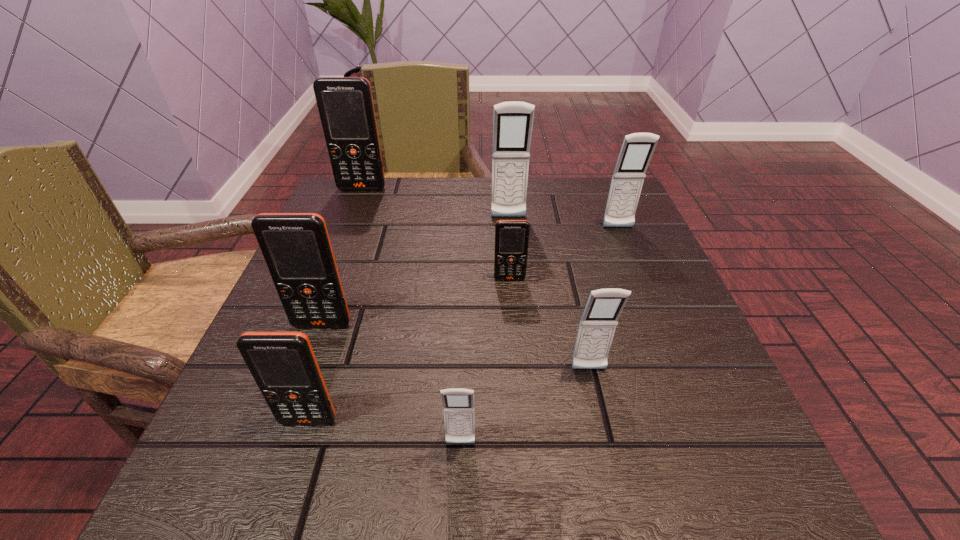
What are the coordinates of `the nearest orange cellular telephone` in the screenshot? It's located at (283, 364).

Identify the location of the second nearest cellular telephone. (283, 364).

The image size is (960, 540). In order to click on the fifth nearest object in this screenshot , I will do `click(511, 236)`.

The height and width of the screenshot is (540, 960). I want to click on the third nearest orange cellular telephone, so click(x=511, y=236).

Find the location of a particular element. This screenshot has height=540, width=960. the nearest cellular telephone is located at coordinates (458, 404).

At what (x,y) coordinates should I click in order to perform the action: click on the leftmost gray cellular telephone. Please return your answer as a coordinate pair (x, y). This screenshot has height=540, width=960. Looking at the image, I should click on (458, 404).

I want to click on blank space located on the screen of the farthest object, so click(350, 219).

Where is `vacant position located 0.290m on the front-facing side of the farthest gray cellular telephone`? The height and width of the screenshot is (540, 960). vacant position located 0.290m on the front-facing side of the farthest gray cellular telephone is located at coordinates (516, 314).

Identify the location of vacant space located 0.240m on the front-facing side of the sixth nearest cellular telephone. The width and height of the screenshot is (960, 540). (652, 309).

Identify the location of vacant area situated 0.200m on the screen of the fourth nearest cellular telephone. (280, 440).